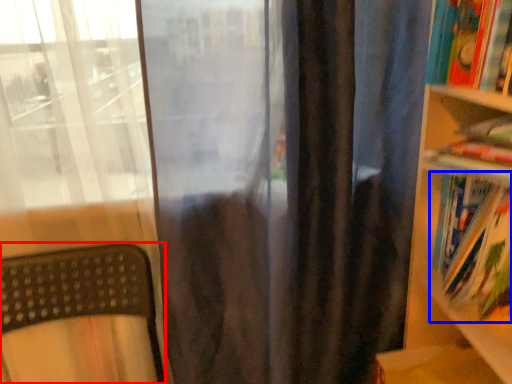
Question: Which point is further to the camera, furniture (highlighted by a red box) or book (highlighted by a blue box)?

Choices:
 (A) furniture
 (B) book

Answer: (B)